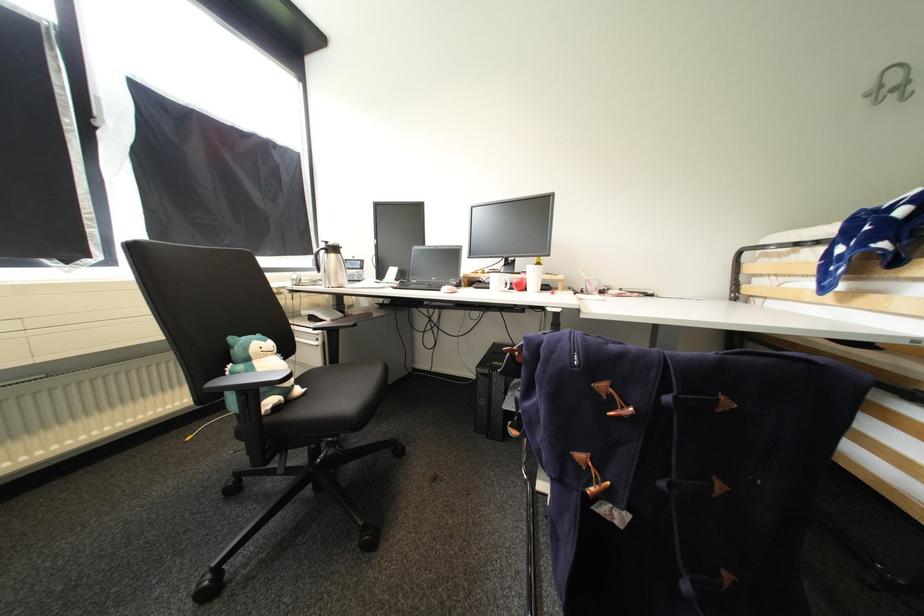
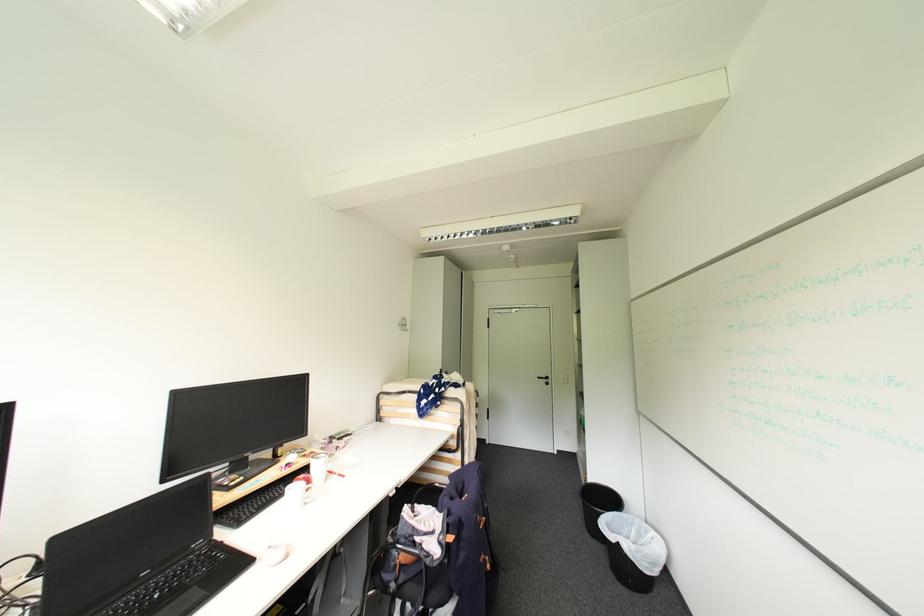
The point at (440, 280) is marked in the first image. Where is the corresponding point in the second image?

(150, 575)